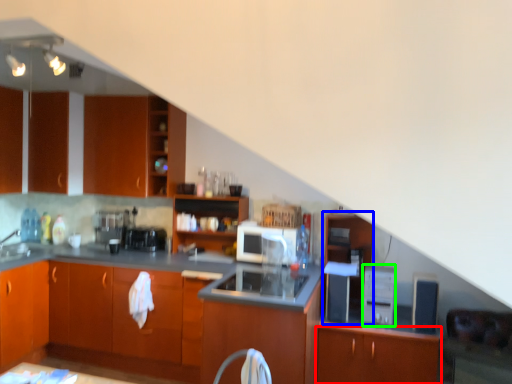
Question: Which is nearer to the cabinetry (highlighted by a red box)? file cabinet (highlighted by a blue box) or appliance (highlighted by a green box).

Choices:
 (A) file cabinet
 (B) appliance

Answer: (B)